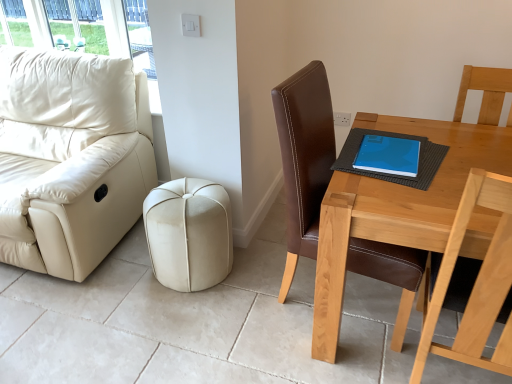
Question: Is blue matte book at upper right in front of or behind brown leather chair at right in the image?

Choices:
 (A) front
 (B) behind

Answer: (B)

Question: Is blue matte book at upper right taller or shorter than brown leather chair at right?

Choices:
 (A) short
 (B) tall

Answer: (A)

Question: Based on their relative distances, which object is nearer to the blue matte book at upper right?

Choices:
 (A) matte cream leather couch at left
 (B) blue matte notebook at table
 (C) beige leather ottoman at center
 (D) brown leather chair at right
 (E) light brown wooden table at right

Answer: (B)

Question: Which of these objects is positioned closest to the beige leather ottoman at center?

Choices:
 (A) light brown wooden table at right
 (B) blue matte notebook at table
 (C) matte cream leather couch at left
 (D) blue matte book at upper right
 (E) brown leather chair at right

Answer: (E)